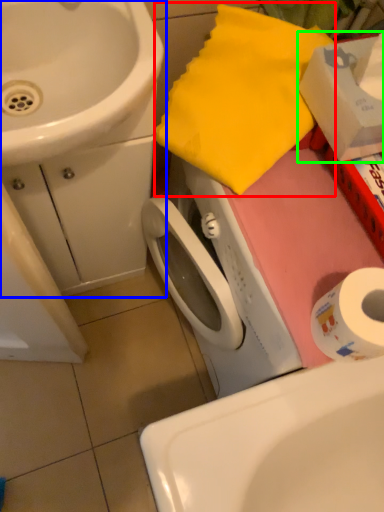
Question: Based on their relative distances, which object is nearer to beach towel (highlighted by a red box)? Choose from sink (highlighted by a blue box) and box (highlighted by a green box).

Choices:
 (A) sink
 (B) box

Answer: (B)